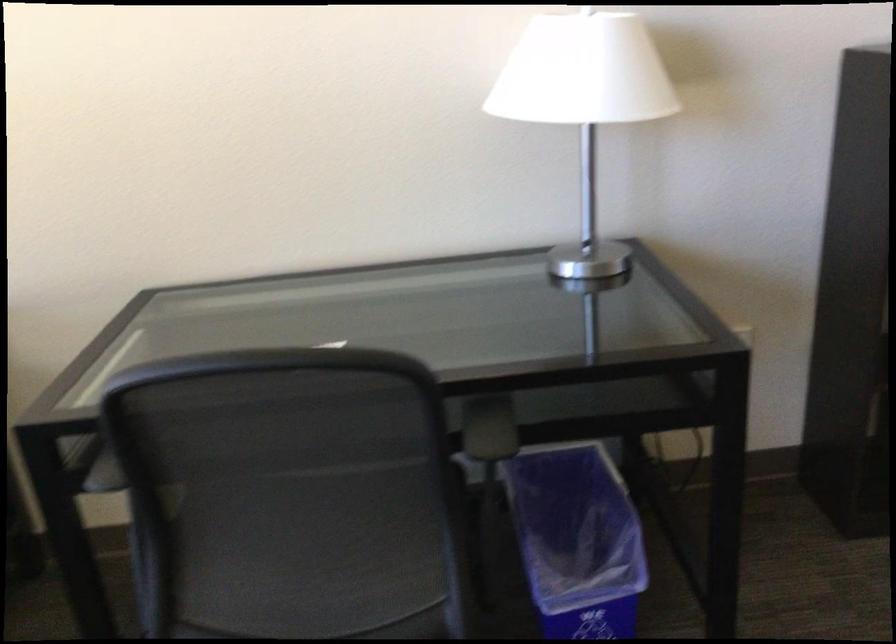
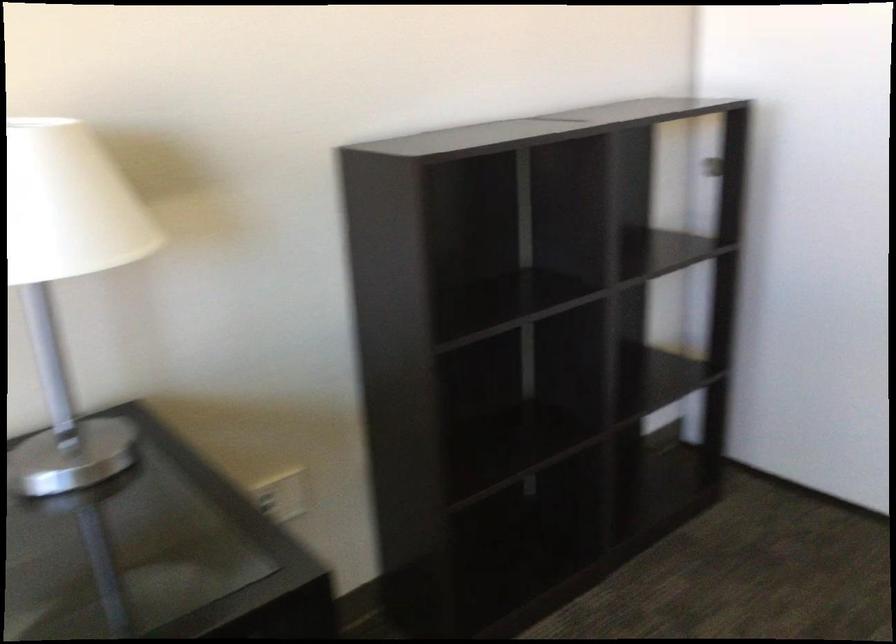
Question: How did the camera likely rotate?

Choices:
 (A) Left
 (B) Right
 (C) Up
 (D) Down

Answer: (B)